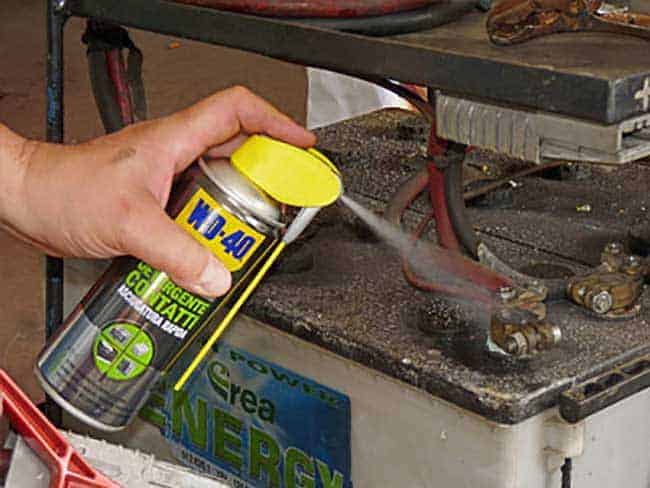
Where is `floor`? floor is located at coordinates (32, 285).